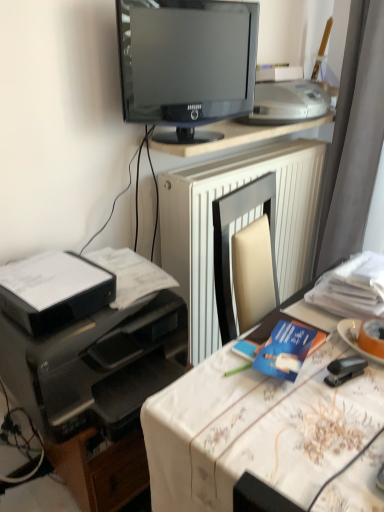
Question: From the image's perspective, relative to orange matte plate at right, is white textured radiator at center above or below?

Choices:
 (A) above
 (B) below

Answer: (A)

Question: From a real-world perspective, is white textured radiator at center above or below orange matte plate at right?

Choices:
 (A) below
 (B) above

Answer: (A)

Question: Which object is the closest to the blue paper at center?

Choices:
 (A) black plastic printer at lower left, which is the 2th printer from top to bottom
 (B) white textured radiator at center
 (C) black plastic printer at left, the 1th printer in the bottom-to-top sequence
 (D) black glossy monitor at upper center
 (E) white plastic printer at upper right, the 1th printer positioned from the top

Answer: (C)

Question: Based on their relative distances, which object is farther from the black plastic printer at lower left, acting as the 2th printer starting from the bottom?

Choices:
 (A) blue paper at center
 (B) white plastic printer at upper right, the 3th printer ordered from the bottom
 (C) orange matte plate at right
 (D) black glossy monitor at upper center
 (E) black plastic printer at left, arranged as the third printer when viewed from the top

Answer: (B)